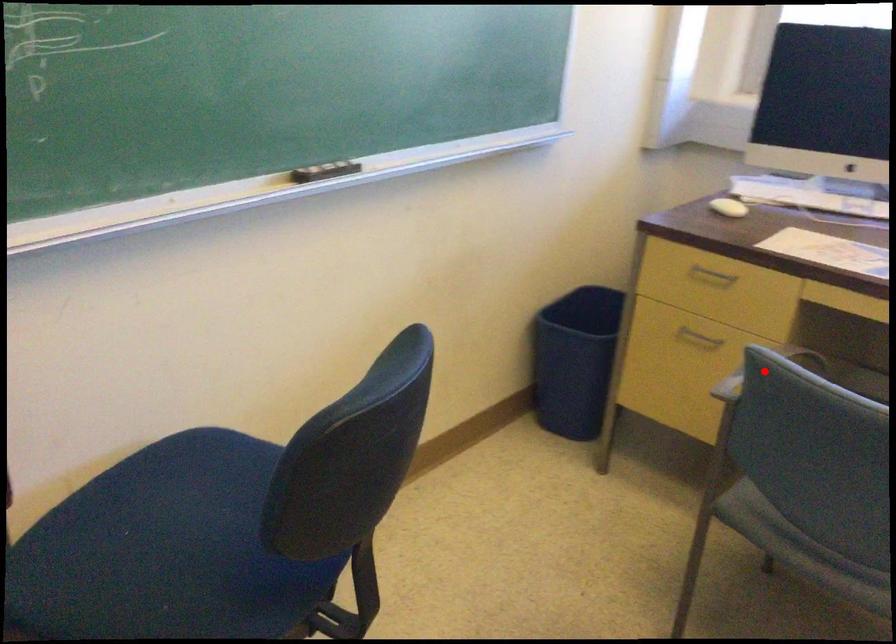
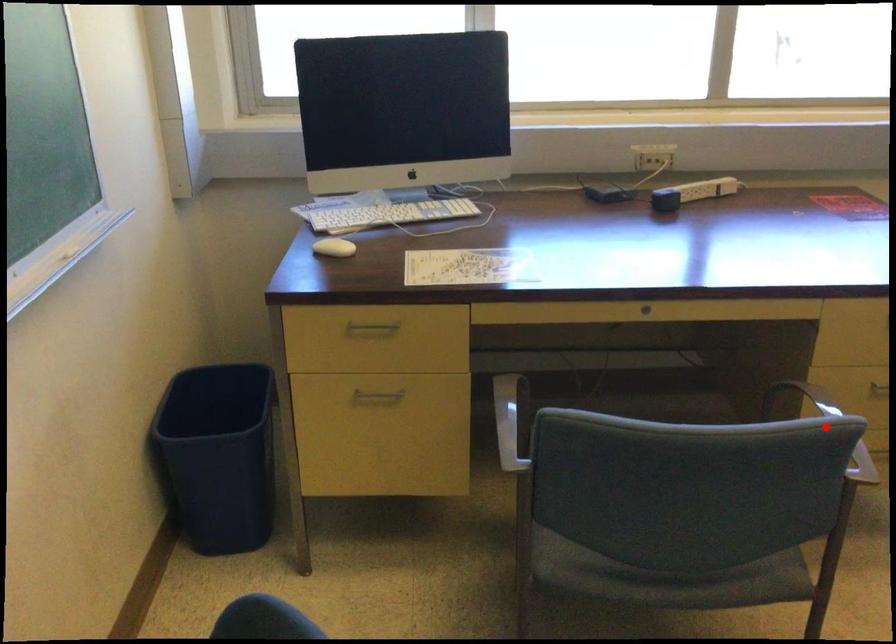
I am providing you with two images of the same scene from different viewpoints. A red point is marked on the first image and another point is marked on the second image. Are the points marked in image1 and image2 representing the same 3D position?

No